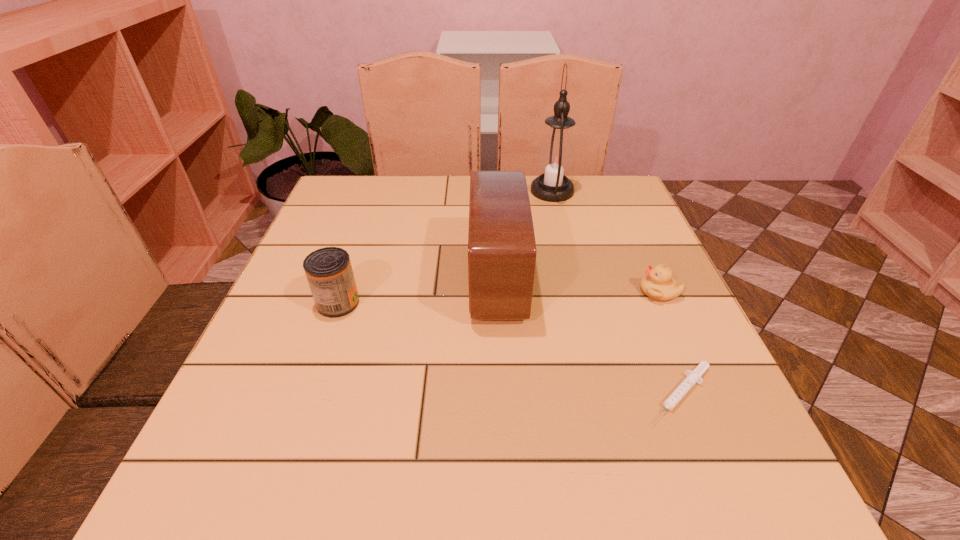
Locate an element on the screen. Image resolution: width=960 pixels, height=540 pixels. free space that satisfies the following two spatial constraints: 1. on the front-facing side of the fourth shortest object; 2. on the front side of the leftmost object is located at coordinates (498, 303).

The height and width of the screenshot is (540, 960). What are the coordinates of `vacant space that satisfies the following two spatial constraints: 1. on the front-facing side of the fourth object from right to left; 2. on the left side of the syringe` in the screenshot? It's located at (502, 394).

At what (x,y) coordinates should I click in order to perform the action: click on vacant position in the image that satisfies the following two spatial constraints: 1. on the front side of the tallest object; 2. on the front-facing side of the fourth object from right to left. Please return your answer as a coordinate pair (x, y). Looking at the image, I should click on (573, 279).